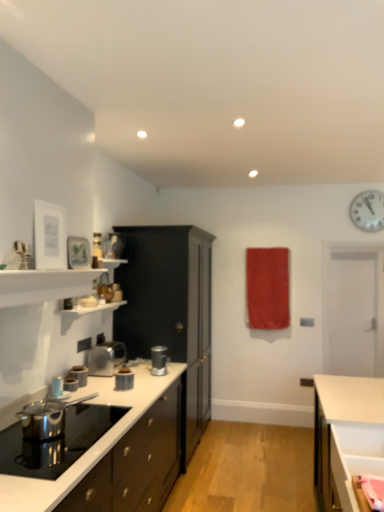
Question: Would you say metallic silver toaster at center, which is the fourth kitchen appliance from left to right, is part of satin silver blender at center, placed as the fifth kitchen appliance when sorted from front to back,'s contents?

Choices:
 (A) no
 (B) yes

Answer: (A)

Question: Is satin silver blender at center, which is counted as the 1th kitchen appliance, starting from the back, bigger than metallic silver toaster at center, which appears as the third kitchen appliance when viewed from the front?

Choices:
 (A) no
 (B) yes

Answer: (B)

Question: Would you consider satin silver blender at center, which is counted as the 1th kitchen appliance, starting from the back, to be distant from metallic silver toaster at center, which ranks as the third kitchen appliance in back-to-front order?

Choices:
 (A) yes
 (B) no

Answer: (B)

Question: From a real-world perspective, is satin silver blender at center, placed as the fifth kitchen appliance when sorted from front to back, on top of metallic silver toaster at center, which ranks as the third kitchen appliance in back-to-front order?

Choices:
 (A) yes
 (B) no

Answer: (A)

Question: Considering the relative sizes of satin silver blender at center, which is counted as the 1th kitchen appliance, starting from the back, and metallic silver toaster at center, which appears as the third kitchen appliance when viewed from the front, in the image provided, is satin silver blender at center, which is counted as the 1th kitchen appliance, starting from the back, smaller than metallic silver toaster at center, which appears as the third kitchen appliance when viewed from the front,?

Choices:
 (A) yes
 (B) no

Answer: (B)

Question: Choose the correct answer: Is glossy dark wood cabinet at lower left, the first cabinetry from the front, inside polished stainless steel kettle at lower left, which ranks as the first appliance in front-to-back order, or outside it?

Choices:
 (A) inside
 (B) outside

Answer: (B)

Question: Is point (142, 451) positioned closer to the camera than point (38, 403)?

Choices:
 (A) farther
 (B) closer

Answer: (A)

Question: Considering the positions of glossy dark wood cabinet at lower left, the first cabinetry from the front, and polished stainless steel kettle at lower left, which ranks as the first appliance in front-to-back order, in the image, is glossy dark wood cabinet at lower left, the first cabinetry from the front, bigger or smaller than polished stainless steel kettle at lower left, which ranks as the first appliance in front-to-back order,?

Choices:
 (A) big
 (B) small

Answer: (A)

Question: Considering their positions, is glossy dark wood cabinet at lower left, the first cabinetry from the front, located in front of or behind polished stainless steel kettle at lower left, which appears as the 2th appliance when viewed from the back?

Choices:
 (A) behind
 (B) front

Answer: (B)

Question: Is black matte cabinet at center, the first cabinetry from the back, bigger or smaller than metallic silver toaster at left, which is counted as the second kitchen appliance, starting from the back?

Choices:
 (A) small
 (B) big

Answer: (B)

Question: In the image, is black matte cabinet at center, the 2th cabinetry in the front-to-back sequence, positioned in front of or behind metallic silver toaster at left, which is counted as the second kitchen appliance, starting from the back?

Choices:
 (A) behind
 (B) front

Answer: (A)

Question: Is point (198, 285) closer or farther from the camera than point (77, 365)?

Choices:
 (A) closer
 (B) farther

Answer: (B)

Question: Choose the correct answer: Is black matte cabinet at center, the first cabinetry from the back, inside metallic silver toaster at left, which is counted as the 3th kitchen appliance, starting from the right, or outside it?

Choices:
 (A) inside
 (B) outside

Answer: (B)

Question: Is metallic silver kettle at left, which appears as the 5th kitchen appliance when viewed from the right, taller or shorter than metallic silver toaster at left, the 4th kitchen appliance viewed from the back?

Choices:
 (A) tall
 (B) short

Answer: (A)

Question: Is metallic silver kettle at left, the 1th kitchen appliance in the left-to-right sequence, spatially inside metallic silver toaster at left, placed as the second kitchen appliance when sorted from front to back, or outside of it?

Choices:
 (A) outside
 (B) inside

Answer: (A)